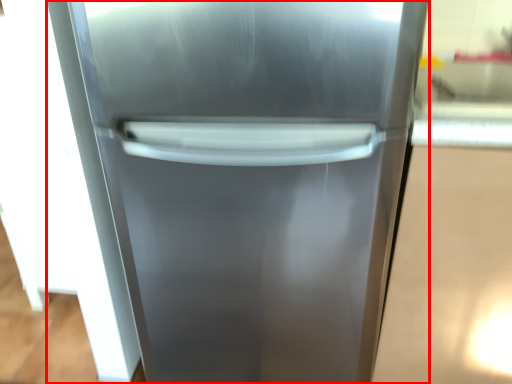
Question: Considering the relative positions of refrigerator (annotated by the red box) and glass door in the image provided, where is refrigerator (annotated by the red box) located with respect to the staircase?

Choices:
 (A) left
 (B) right

Answer: (B)